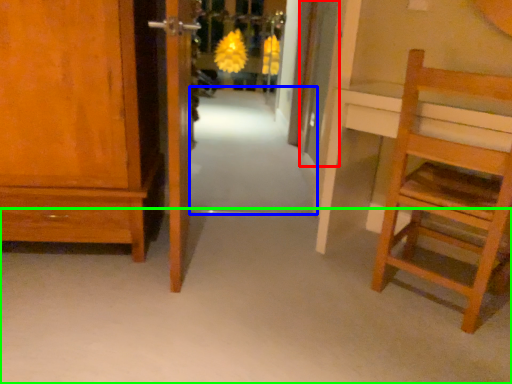
Question: Which is farther away from door (highlighted by a red box)? path (highlighted by a blue box) or plain (highlighted by a green box)?

Choices:
 (A) path
 (B) plain

Answer: (B)